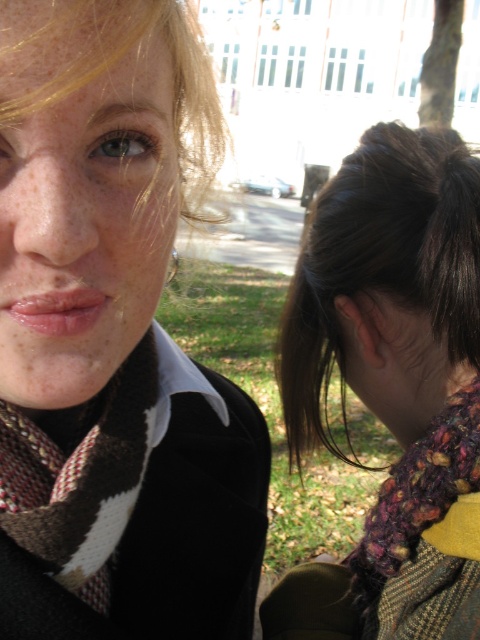
Does multicolored knitted scarf at left have a larger size compared to brown and white knitted scarf at left?

Indeed, multicolored knitted scarf at left has a larger size compared to brown and white knitted scarf at left.

Describe the element at coordinates (112, 339) in the screenshot. I see `multicolored knitted scarf at left` at that location.

Locate an element on the screen. The width and height of the screenshot is (480, 640). multicolored knitted scarf at left is located at coordinates (112, 339).

Can you confirm if brown and white knitted scarf at left is wider than knitted multicolor scarf at lower right?

In fact, brown and white knitted scarf at left might be narrower than knitted multicolor scarf at lower right.

Between brown and white knitted scarf at left and knitted multicolor scarf at lower right, which one appears on the right side from the viewer's perspective?

Positioned to the right is knitted multicolor scarf at lower right.

This screenshot has height=640, width=480. Describe the element at coordinates (80, 481) in the screenshot. I see `brown and white knitted scarf at left` at that location.

This screenshot has width=480, height=640. I want to click on brown and white knitted scarf at left, so click(x=80, y=481).

Does multicolored knitted scarf at left appear under knitted multicolored scarf at lower right?

Yes, multicolored knitted scarf at left is below knitted multicolored scarf at lower right.

Who is positioned more to the left, multicolored knitted scarf at left or knitted multicolored scarf at lower right?

multicolored knitted scarf at left

Is point (146, 124) less distant than point (434, 449)?

Yes, it is in front of point (434, 449).

The height and width of the screenshot is (640, 480). I want to click on multicolored knitted scarf at left, so click(x=112, y=339).